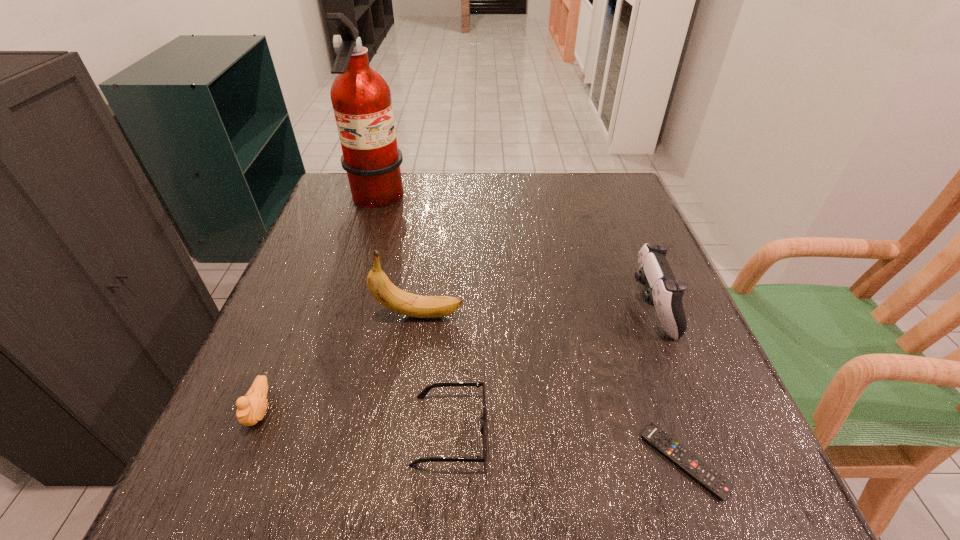
Find the location of a particular element. Image resolution: width=960 pixels, height=540 pixels. free space located on the front-facing side of the control is located at coordinates (512, 308).

Locate an element on the screen. This screenshot has width=960, height=540. vacant position located on the front-facing side of the control is located at coordinates (594, 308).

Locate an element on the screen. free space located on the front-facing side of the sunglasses is located at coordinates (725, 429).

Where is `free spot located on the back of the remote control`? The height and width of the screenshot is (540, 960). free spot located on the back of the remote control is located at coordinates (647, 355).

I want to click on object located in the far edge section of the desktop, so click(x=361, y=99).

Where is `sunglasses situated at the near edge`? sunglasses situated at the near edge is located at coordinates (422, 395).

In order to click on remote control that is at the near edge in this screenshot , I will do `click(713, 481)`.

The width and height of the screenshot is (960, 540). I want to click on fire extinguisher present at the left edge, so click(361, 99).

Where is `duckling that is at the left edge`? duckling that is at the left edge is located at coordinates (250, 409).

Find the location of a particular element. control positioned at the right edge is located at coordinates (664, 292).